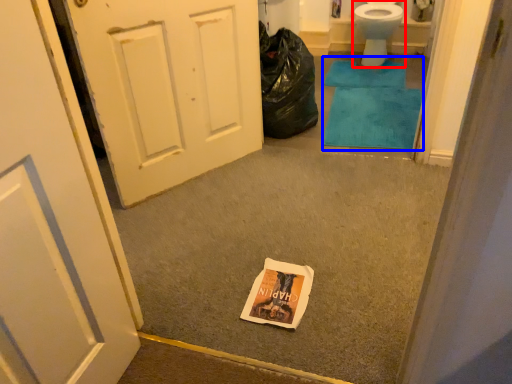
Question: Which point is further to the camera, toilet (highlighted by a red box) or bath mat (highlighted by a blue box)?

Choices:
 (A) toilet
 (B) bath mat

Answer: (A)